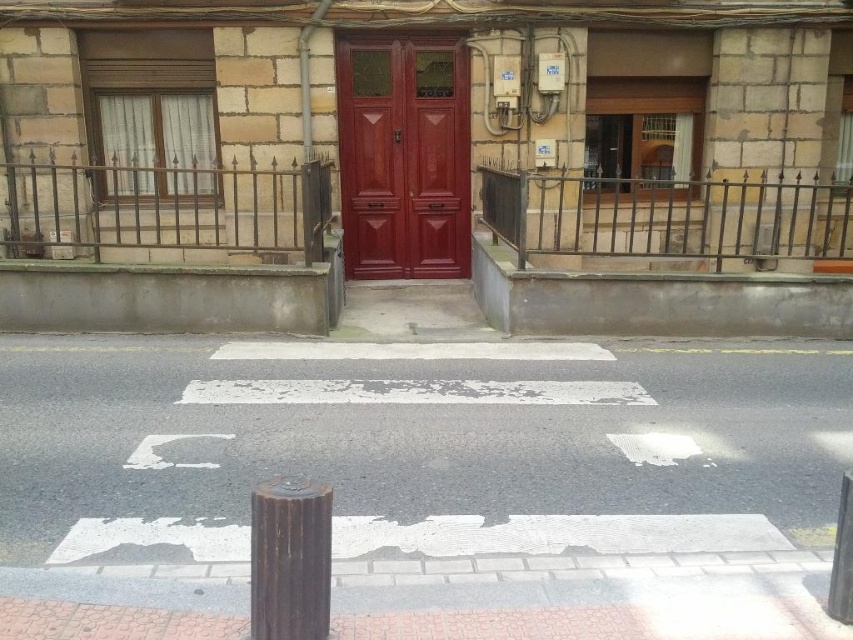
Question: Which of the following is the closest to the observer?

Choices:
 (A) (375, 211)
 (B) (531, 301)

Answer: (B)

Question: Estimate the real-world distances between objects in this image. Which object is farther from the rusty metal pole at lower center?

Choices:
 (A) white asphalt at center
 (B) gray concrete curb at lower center
 (C) matte wood door at center

Answer: (C)

Question: Is matte wood door at center thinner than rusty metal pole at lower center?

Choices:
 (A) no
 (B) yes

Answer: (A)

Question: Which object is positioned farthest from the gray concrete curb at lower center?

Choices:
 (A) matte wood door at center
 (B) rusty metal pole at lower center

Answer: (B)

Question: Is matte wood door at center positioned behind gray concrete curb at lower center?

Choices:
 (A) yes
 (B) no

Answer: (A)

Question: Can you confirm if gray concrete curb at lower center is wider than rusty metal pole at lower center?

Choices:
 (A) yes
 (B) no

Answer: (A)